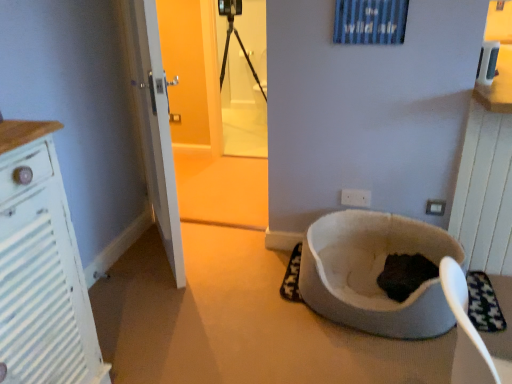
Question: Should I look upward or downward to see white fabric cat bed at lower right?

Choices:
 (A) up
 (B) down

Answer: (B)

Question: Is white plastic electric outlet at center, positioned as the 1th electric outlet in back-to-front order, smaller than white fabric cat bed at lower right?

Choices:
 (A) yes
 (B) no

Answer: (A)

Question: Is white plastic electric outlet at center, which appears as the second electric outlet when viewed from the right, thinner than white fabric cat bed at lower right?

Choices:
 (A) yes
 (B) no

Answer: (A)

Question: From a real-world perspective, is white plastic electric outlet at center, positioned as the 1th electric outlet in back-to-front order, over white fabric cat bed at lower right?

Choices:
 (A) no
 (B) yes

Answer: (B)

Question: Is white plastic electric outlet at center, marked as the 1th electric outlet in a left-to-right arrangement, facing away from white fabric cat bed at lower right?

Choices:
 (A) yes
 (B) no

Answer: (B)

Question: Does white plastic electric outlet at center, marked as the 1th electric outlet in a left-to-right arrangement, turn towards white fabric cat bed at lower right?

Choices:
 (A) yes
 (B) no

Answer: (B)

Question: Is the depth of white plastic electric outlet at center, positioned as the 1th electric outlet in back-to-front order, less than that of white fabric cat bed at lower right?

Choices:
 (A) no
 (B) yes

Answer: (A)

Question: Is white plastic electric outlet at center, marked as the 1th electric outlet in a left-to-right arrangement, to the left of white plastic electric outlet at lower right, marked as the first electric outlet in a front-to-back arrangement, from the viewer's perspective?

Choices:
 (A) no
 (B) yes

Answer: (B)

Question: From a real-world perspective, is white plastic electric outlet at center, positioned as the 1th electric outlet in back-to-front order, located beneath white plastic electric outlet at lower right, positioned as the 1th electric outlet in right-to-left order?

Choices:
 (A) yes
 (B) no

Answer: (B)

Question: Is white plastic electric outlet at center, positioned as the 1th electric outlet in back-to-front order, facing towards white plastic electric outlet at lower right, placed as the 2th electric outlet when sorted from left to right?

Choices:
 (A) no
 (B) yes

Answer: (A)

Question: Is white plastic electric outlet at center, which appears as the second electric outlet when viewed from the right, not within white plastic electric outlet at lower right, placed as the 2th electric outlet when sorted from back to front?

Choices:
 (A) no
 (B) yes

Answer: (B)

Question: From a real-world perspective, is white plastic electric outlet at center, positioned as the 1th electric outlet in back-to-front order, positioned over white plastic electric outlet at lower right, placed as the 2th electric outlet when sorted from left to right, based on gravity?

Choices:
 (A) yes
 (B) no

Answer: (A)

Question: Considering the relative positions of white plastic electric outlet at center, which ranks as the 2th electric outlet in front-to-back order, and white plastic electric outlet at lower right, marked as the first electric outlet in a front-to-back arrangement, in the image provided, is white plastic electric outlet at center, which ranks as the 2th electric outlet in front-to-back order, in front of white plastic electric outlet at lower right, marked as the first electric outlet in a front-to-back arrangement,?

Choices:
 (A) no
 (B) yes

Answer: (A)

Question: Considering the relative positions of white plastic electric outlet at lower right, placed as the 2th electric outlet when sorted from left to right, and white plastic electric outlet at center, positioned as the 1th electric outlet in back-to-front order, in the image provided, is white plastic electric outlet at lower right, placed as the 2th electric outlet when sorted from left to right, to the left of white plastic electric outlet at center, positioned as the 1th electric outlet in back-to-front order, from the viewer's perspective?

Choices:
 (A) no
 (B) yes

Answer: (A)